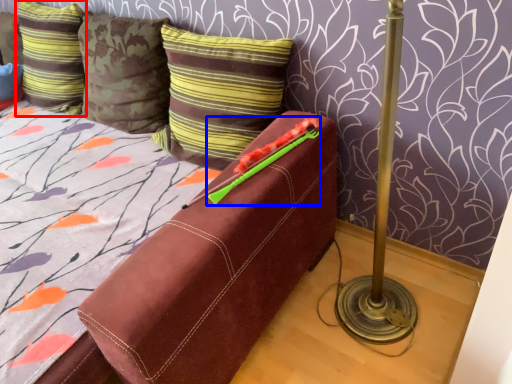
Question: Which object is closer to the camera taking this photo, pillow (highlighted by a red box) or crayon (highlighted by a blue box)?

Choices:
 (A) pillow
 (B) crayon

Answer: (B)